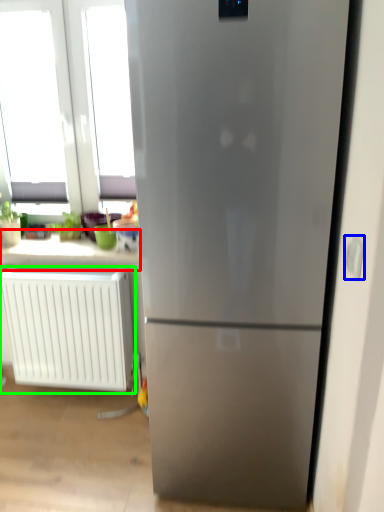
Question: Which object is positioned farthest from counter top (highlighted by a red box)? Select from electric outlet (highlighted by a blue box) and radiator (highlighted by a green box).

Choices:
 (A) electric outlet
 (B) radiator

Answer: (A)